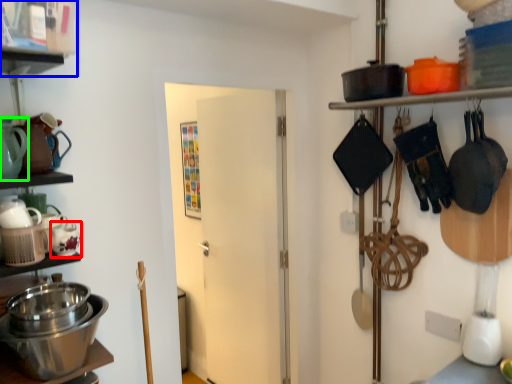
Question: Which is farther away from tea pot (highlighted by a red box)? shelf (highlighted by a blue box) or tea pot (highlighted by a green box)?

Choices:
 (A) shelf
 (B) tea pot

Answer: (A)